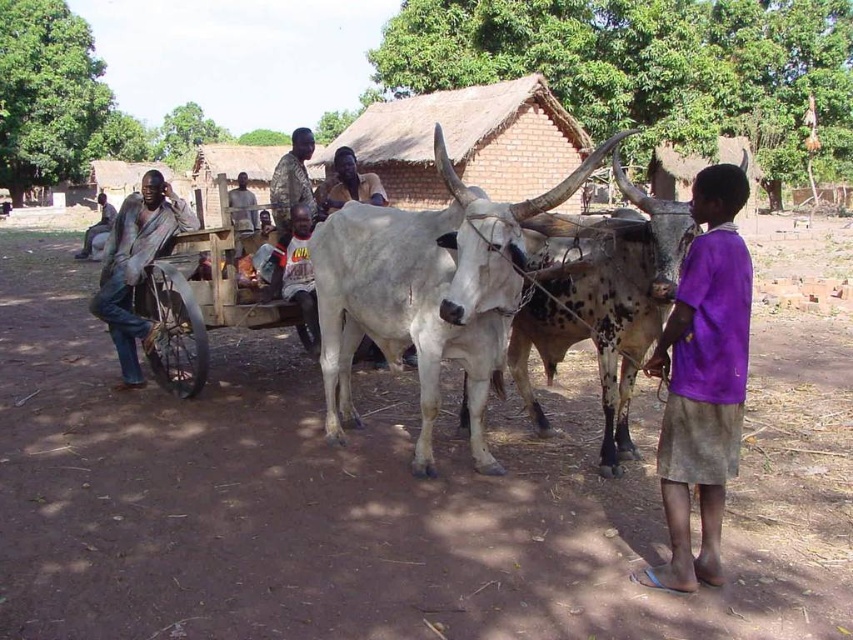
Who is higher up, white matte bull at center or white smooth cow at center?

white matte bull at center

Is white matte bull at center behind white smooth cow at center?

Answer: No, it is not.

Who is more forward, (x=463, y=186) or (x=556, y=304)?

Point (x=463, y=186) is more forward.

At what (x,y) coordinates should I click in order to perform the action: click on white matte bull at center. Please return your answer as a coordinate pair (x, y). The width and height of the screenshot is (853, 640). Looking at the image, I should click on (440, 292).

Between point (657, 212) and point (306, 179), which one is positioned in front?

Positioned in front is point (657, 212).

Is white smooth cow at center closer to the viewer compared to camouflage fabric shirt at center?

Yes.

Where is `white smooth cow at center`? The height and width of the screenshot is (640, 853). white smooth cow at center is located at coordinates (601, 301).

Can you confirm if white matte bull at center is smaller than purple cotton shirt at center?

No.

Does white matte bull at center have a lesser height compared to purple cotton shirt at center?

Yes, white matte bull at center is shorter than purple cotton shirt at center.

This screenshot has height=640, width=853. Describe the element at coordinates (440, 292) in the screenshot. I see `white matte bull at center` at that location.

At what (x,y) coordinates should I click in order to perform the action: click on white matte bull at center. Please return your answer as a coordinate pair (x, y). Looking at the image, I should click on (440, 292).